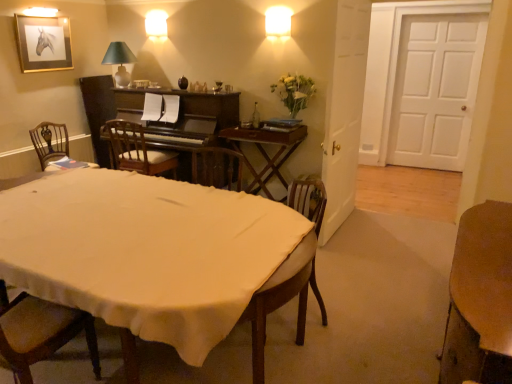
The image size is (512, 384). What are the coordinates of `empty space that is ontop of gold-framed picture at upper left (from a real-world perspective)` in the screenshot? It's located at (44, 16).